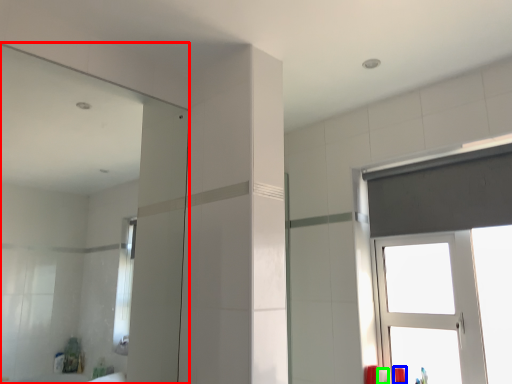
Question: Which object is the closest to the mirror (highlighted by a red box)? Choose among these: toiletry (highlighted by a blue box) or toiletry (highlighted by a green box).

Choices:
 (A) toiletry
 (B) toiletry

Answer: (B)